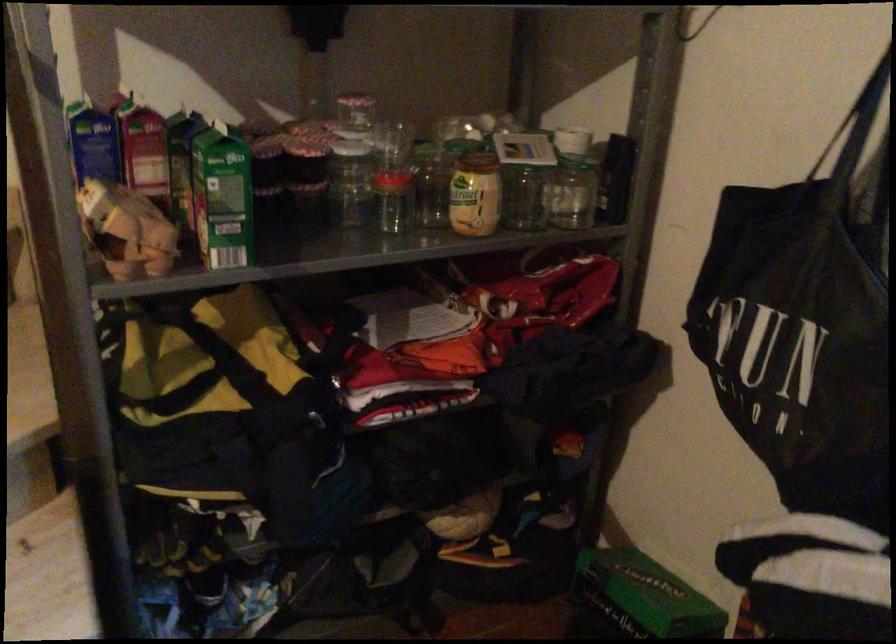
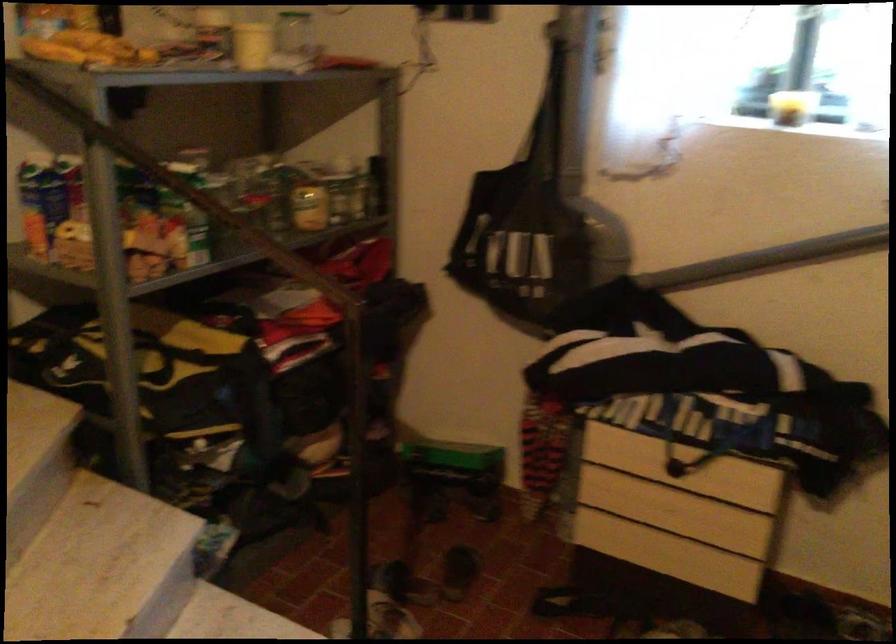
Where in the second image is the point corresponding to [385,569] from the first image?

(290, 495)